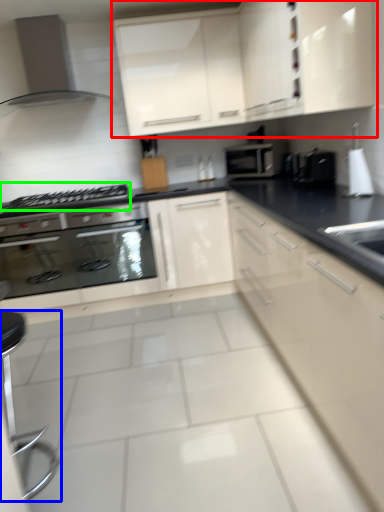
Question: Estimate the real-world distances between objects in this image. Which object is farther from cabinetry (highlighted by a red box), bar stool (highlighted by a blue box) or gas stove (highlighted by a green box)?

Choices:
 (A) bar stool
 (B) gas stove

Answer: (A)